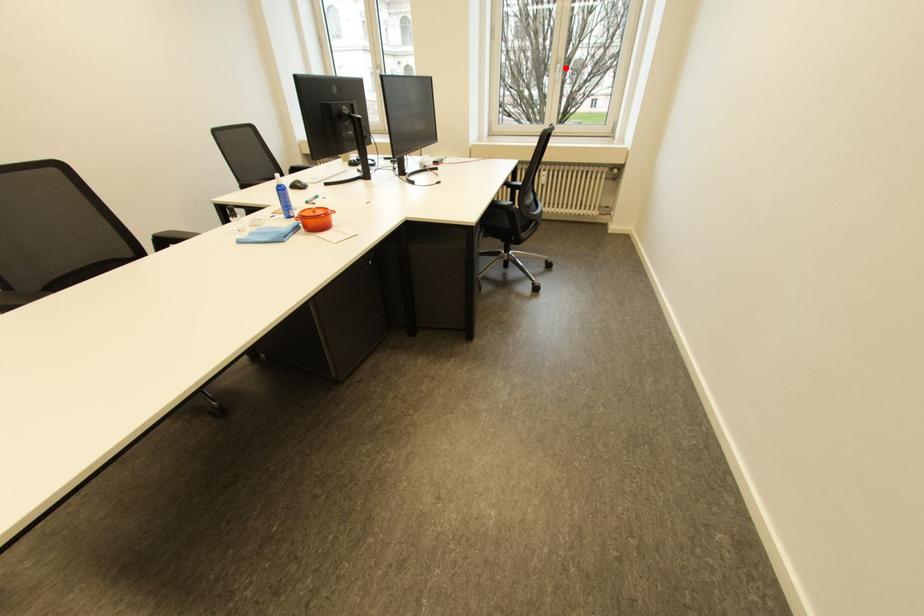
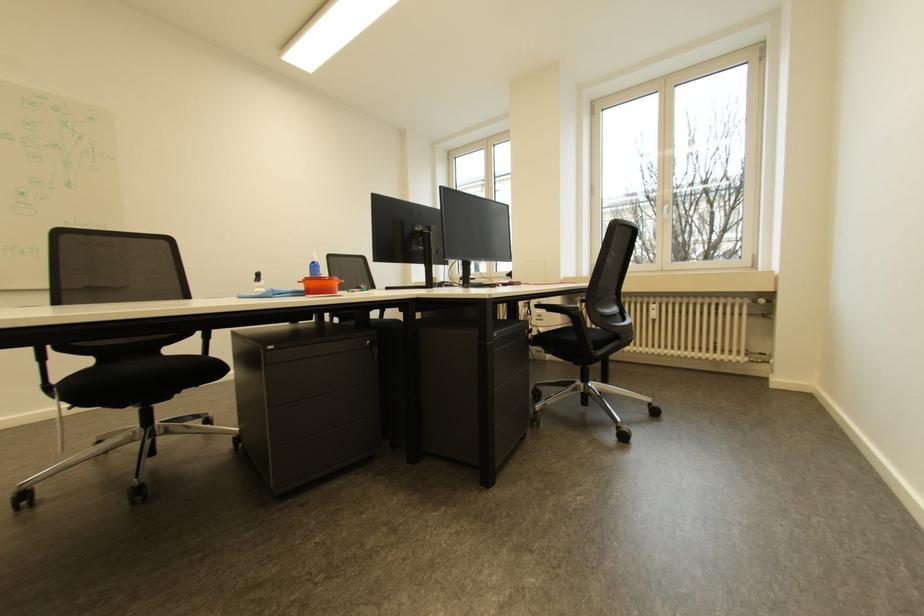
Question: I am providing you with two images of the same scene from different viewpoints. A red point is marked on the first image. Can you still see the location of the red point in image 2?

Choices:
 (A) Yes
 (B) No

Answer: (A)